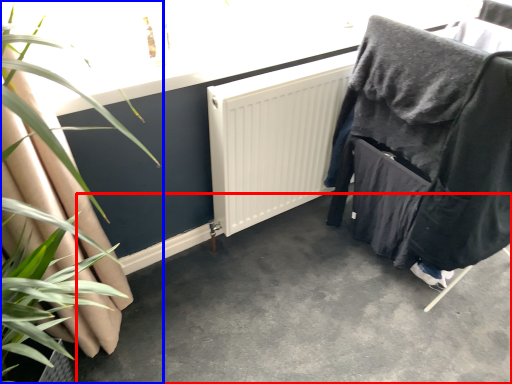
Question: Which of the following is the farthest to the observer, concrete (highlighted by a red box) or houseplant (highlighted by a blue box)?

Choices:
 (A) concrete
 (B) houseplant

Answer: (A)